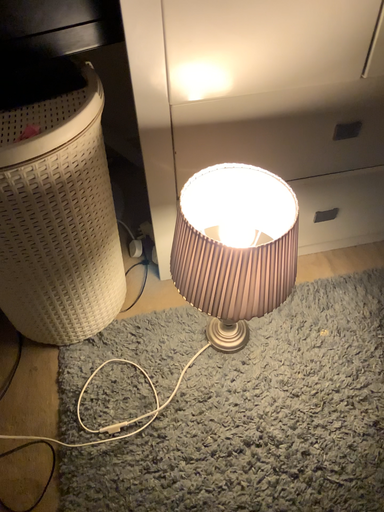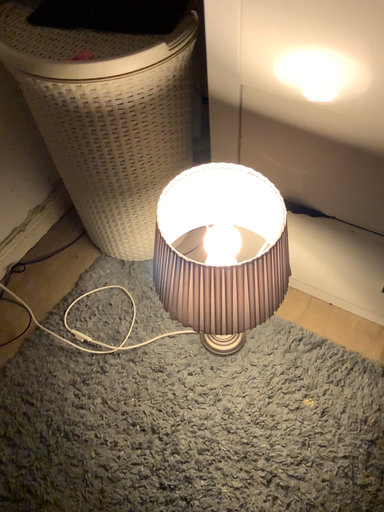
Question: Which way did the camera rotate in the video?

Choices:
 (A) rotated left
 (B) rotated right

Answer: (A)